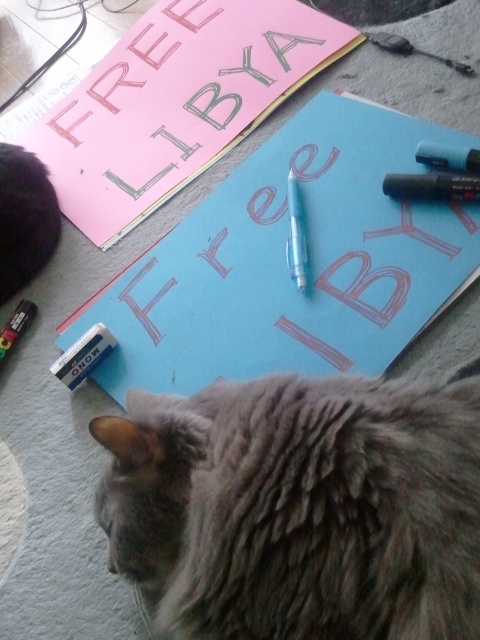
You are trying to pick up the translucent plastic pencil at center without disturbing the gray fluffy cat at upper left. Based on their positions, is the pencil located below or above the cat?

The gray fluffy cat at upper left is above the translucent plastic pencil at center, so the pencil is located below the cat.

In the scene shown: You are an animal photographer trying to capture the gray fluffy cat at lower center and the gray fluffy cat at upper left in a single frame. Which cat should you focus on to ensure both fit comfortably in the photo without cropping?

You should focus on the gray fluffy cat at lower center because its width is larger than the gray fluffy cat at upper left, so positioning the camera to accommodate the larger cat will naturally include the smaller one in the frame.